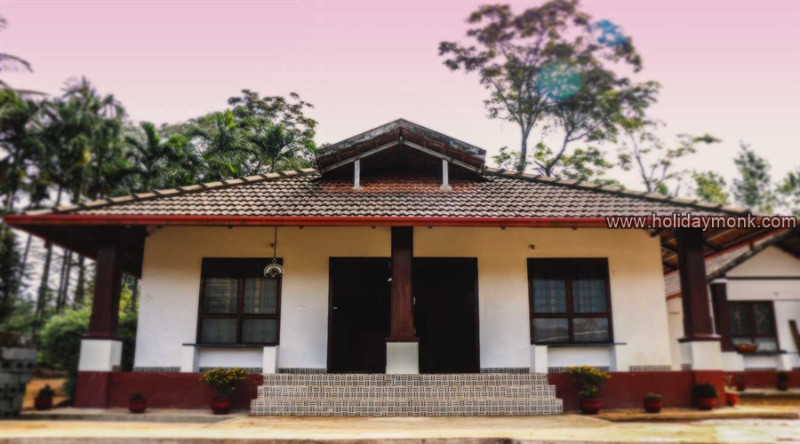
Find the location of a particular element. This screenshot has width=800, height=444. big doors is located at coordinates (421, 298).